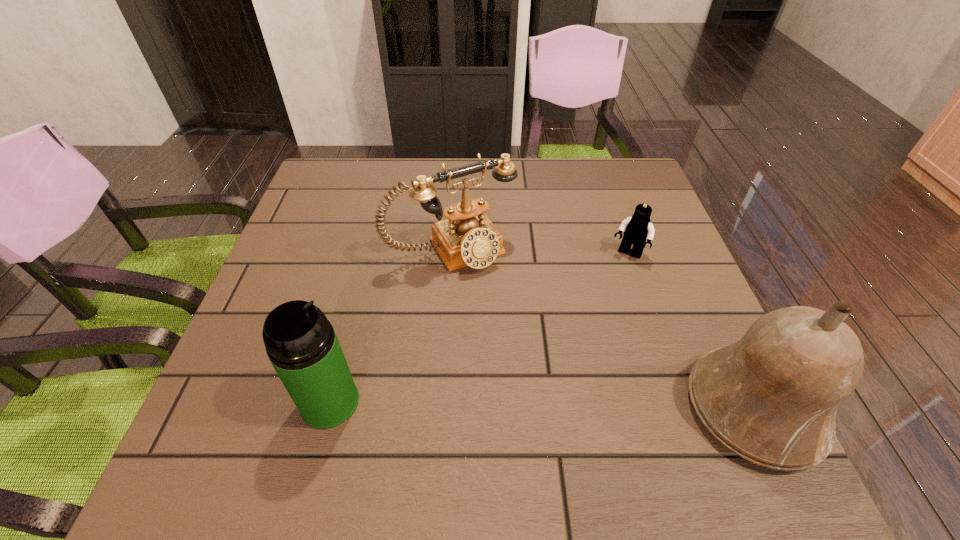
The height and width of the screenshot is (540, 960). In order to click on thermos bottle in this screenshot , I will do pyautogui.click(x=301, y=344).

Where is `bell`? The height and width of the screenshot is (540, 960). bell is located at coordinates (772, 397).

Locate an element on the screen. the shortest object is located at coordinates (637, 229).

Find the location of a particular element. The image size is (960, 540). telephone is located at coordinates (467, 237).

This screenshot has width=960, height=540. Identify the location of vacant area situated 0.210m from the spout of the thermos bottle. (476, 402).

Find the location of a particular element. This screenshot has height=540, width=960. free space located 0.080m on the back of the bell is located at coordinates (713, 321).

Identify the location of free space located on the front-facing side of the shortest object. (578, 360).

At what (x,y) coordinates should I click in order to perform the action: click on vacant space located on the front-facing side of the shortest object. Please return your answer as a coordinate pair (x, y). Image resolution: width=960 pixels, height=540 pixels. Looking at the image, I should click on (604, 305).

I want to click on vacant space located on the front-facing side of the shortest object, so click(x=607, y=298).

The height and width of the screenshot is (540, 960). Identify the location of vacant region located on the dial number of the second shortest object. (540, 364).